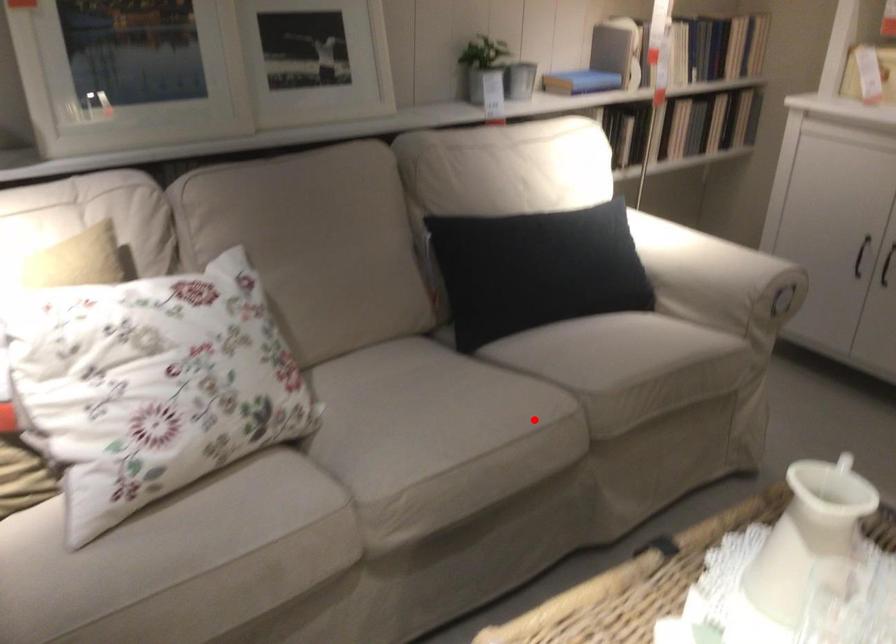
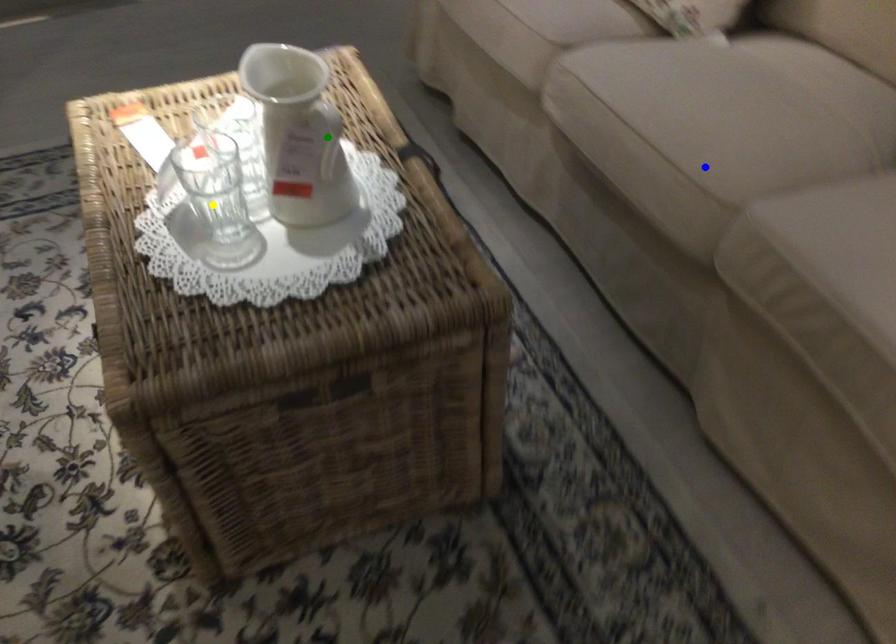
Question: I am providing you with two images of the same scene from different viewpoints. A red point is marked on the first image. You are given multiple points on the second image. Which mark in image 2 goes with the point in image 1?

Choices:
 (A) green point
 (B) yellow point
 (C) blue point

Answer: (C)